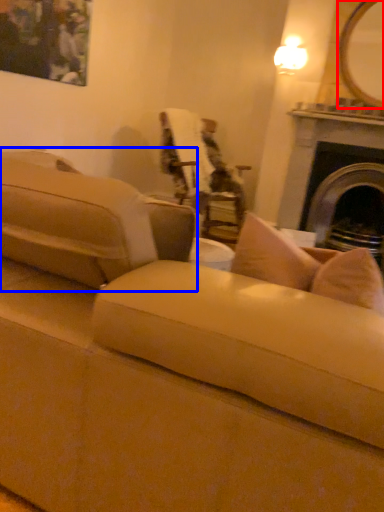
Question: Which of the following is the closest to the observer, mirror (highlighted by a red box) or studio couch (highlighted by a blue box)?

Choices:
 (A) mirror
 (B) studio couch

Answer: (B)